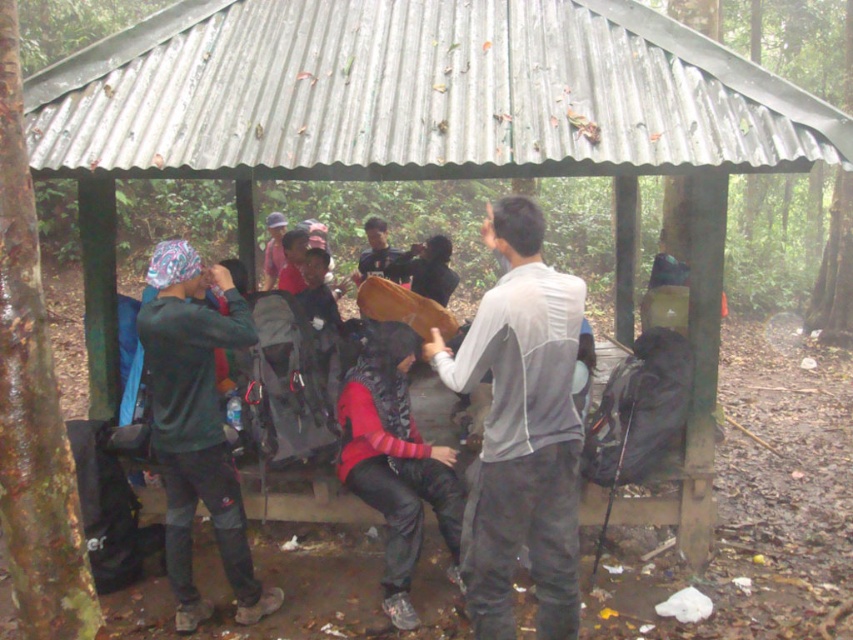
You are a hiker trying to identify two people in the group. You notice a person wearing a red sweater at center and another wearing a dark gray fabric shirt at center. Which one is positioned more to the right?

The red sweater at center is positioned more to the right than the dark gray fabric shirt at center.

You are a photographer trying to capture a candid shot of the group under the shelter. You have a camera with a 50mm lens. The camera is placed on a tripod 2 meters away from the dark green fabric jacket at left. Can you fit the entire group into your frame without moving the tripod? The camera has a field of view of 46 degrees at 50mm.

The distance between the dark green fabric jacket at left and the camera is 3.94 meters. Since the camera is placed 2 meters away from the jacket, the total distance from the camera to the farthest part of the group would be more than 2 meters. With a 50mm lens providing a 46 degree field of view, the maximum width the camera can capture at 2 meters is approximately 3.03 meters. If the group spans beyond this width, moving the tripod closer or using a wider lens would be necessary to include everyone.

You are a photographer trying to capture both the gray matte shirt at center and the red sweater at center in a single frame. Which clothing item appears narrower in the photo?

The gray matte shirt at center appears narrower in the photo because it has a lesser width compared to the red sweater at center.